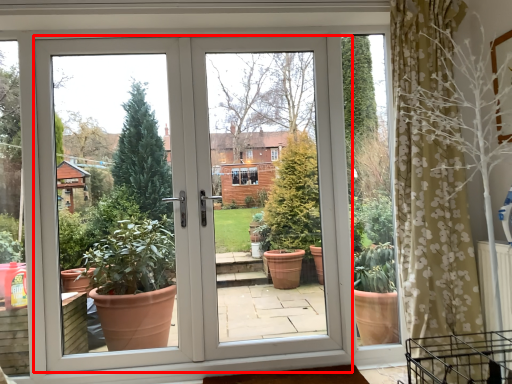
Question: In this image, where is door (annotated by the red box) located relative to screen door?

Choices:
 (A) right
 (B) left

Answer: (B)